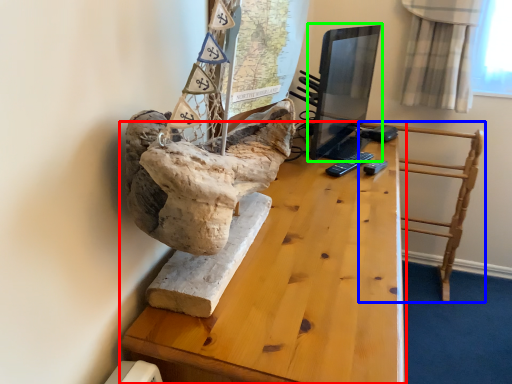
Question: Based on their relative distances, which object is nearer to table (highlighted by a red box)? Choose from furniture (highlighted by a blue box) and computer monitor (highlighted by a green box).

Choices:
 (A) furniture
 (B) computer monitor

Answer: (A)